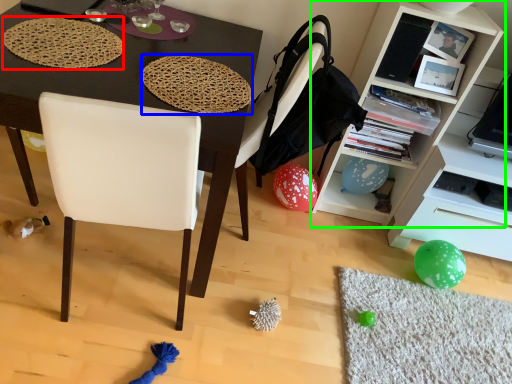
Question: Considering the real-world distances, which object is closest to mat (highlighted by a red box)? mat (highlighted by a blue box) or cabinetry (highlighted by a green box).

Choices:
 (A) mat
 (B) cabinetry

Answer: (A)